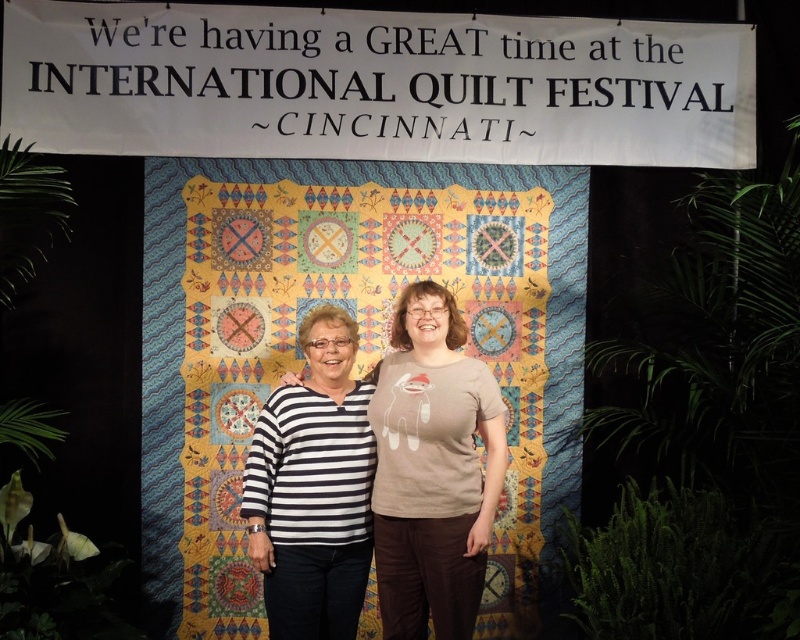
You are a photographer at the International Quilt Festival in Cincinnati. You want to capture a photo of the multicolored fabric quilt at center and the green leafy plant at right. Based on their positions, which object is located to the left?

The multicolored fabric quilt at center is positioned on the left side of green leafy plant at right, so the multicolored fabric quilt at center is located to the left.